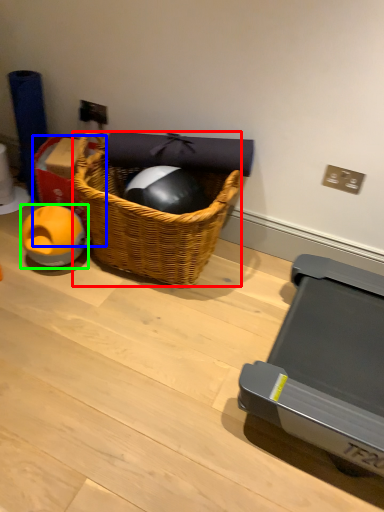
Question: Based on their relative distances, which object is nearer to picnic basket (highlighted by a red box)? Choose from box (highlighted by a blue box) and toy (highlighted by a green box).

Choices:
 (A) box
 (B) toy

Answer: (A)